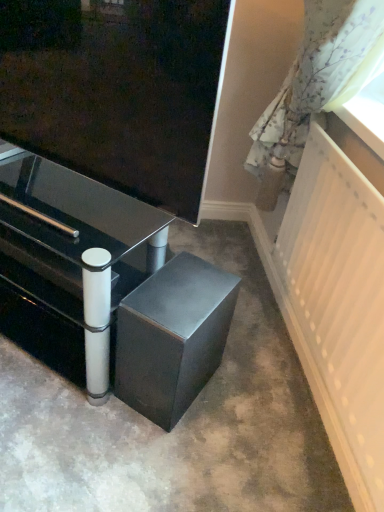
Question: Does satin black speaker at lower center appear on the left side of white glossy drawer at lower left?

Choices:
 (A) yes
 (B) no

Answer: (B)

Question: Considering the relative sizes of satin black speaker at lower center and white glossy drawer at lower left in the image provided, is satin black speaker at lower center thinner than white glossy drawer at lower left?

Choices:
 (A) no
 (B) yes

Answer: (A)

Question: Can you confirm if satin black speaker at lower center is bigger than white glossy drawer at lower left?

Choices:
 (A) yes
 (B) no

Answer: (A)

Question: From a real-world perspective, is satin black speaker at lower center positioned over white glossy drawer at lower left based on gravity?

Choices:
 (A) no
 (B) yes

Answer: (A)

Question: Is satin black speaker at lower center far from white glossy drawer at lower left?

Choices:
 (A) no
 (B) yes

Answer: (A)

Question: Based on their positions, is satin black speaker at lower center located to the left or right of floral fabric curtain at right?

Choices:
 (A) left
 (B) right

Answer: (A)

Question: In terms of width, does satin black speaker at lower center look wider or thinner when compared to floral fabric curtain at right?

Choices:
 (A) wide
 (B) thin

Answer: (A)

Question: From the image's perspective, relative to floral fabric curtain at right, is satin black speaker at lower center above or below?

Choices:
 (A) above
 (B) below

Answer: (B)

Question: Relative to floral fabric curtain at right, is satin black speaker at lower center in front or behind?

Choices:
 (A) behind
 (B) front

Answer: (A)

Question: In terms of width, does metallic black table at lower center look wider or thinner when compared to floral fabric curtain at right?

Choices:
 (A) thin
 (B) wide

Answer: (B)

Question: From their relative heights in the image, would you say metallic black table at lower center is taller or shorter than floral fabric curtain at right?

Choices:
 (A) tall
 (B) short

Answer: (A)

Question: Is metallic black table at lower center spatially inside floral fabric curtain at right, or outside of it?

Choices:
 (A) outside
 (B) inside

Answer: (A)

Question: Looking at the image, does metallic black table at lower center seem bigger or smaller compared to floral fabric curtain at right?

Choices:
 (A) small
 (B) big

Answer: (B)

Question: Would you say white glossy drawer at lower left is to the left or to the right of floral fabric curtain at right in the picture?

Choices:
 (A) right
 (B) left

Answer: (B)

Question: Is point (9, 273) closer or farther from the camera than point (337, 91)?

Choices:
 (A) farther
 (B) closer

Answer: (A)